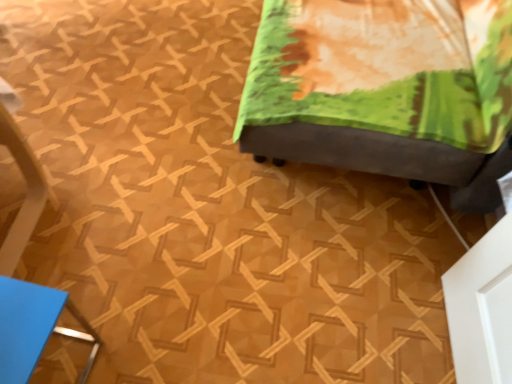
At what (x,y) coordinates should I click in order to perform the action: click on velvet green ottoman at center, which appears as the first furniture when viewed from the right. Please return your answer as a coordinate pair (x, y). This screenshot has height=384, width=512. Looking at the image, I should click on (391, 115).

What do you see at coordinates (391, 115) in the screenshot? The height and width of the screenshot is (384, 512). I see `velvet green ottoman at center, which appears as the first furniture when viewed from the right` at bounding box center [391, 115].

Where is `blue matte folder at lower left, marked as the first furniture in a bottom-to-top arrangement`? Image resolution: width=512 pixels, height=384 pixels. blue matte folder at lower left, marked as the first furniture in a bottom-to-top arrangement is located at coordinates (33, 327).

What is the approximate height of blue matte folder at lower left, marked as the first furniture in a bottom-to-top arrangement?

It is 14.44 inches.

Measure the distance between point (12, 351) and camera.

32.32 inches.

Describe the element at coordinates (33, 327) in the screenshot. The image size is (512, 384). I see `blue matte folder at lower left, the 1th furniture when ordered from left to right` at that location.

Identify the location of velvet green ottoman at center, which appears as the first furniture when viewed from the right. (391, 115).

Is blue matte folder at lower left, the 1th furniture when ordered from left to right, at the right side of velvet green ottoman at center, placed as the 2th furniture when sorted from bottom to top?

No, blue matte folder at lower left, the 1th furniture when ordered from left to right, is not to the right of velvet green ottoman at center, placed as the 2th furniture when sorted from bottom to top.

From the picture: Between blue matte folder at lower left, the 1th furniture when ordered from left to right, and velvet green ottoman at center, which appears as the first furniture when viewed from the right, which one is positioned in front?

blue matte folder at lower left, the 1th furniture when ordered from left to right, is closer to the camera.

Considering the points (6, 382) and (245, 123), which point is in front, point (6, 382) or point (245, 123)?

The point (6, 382) is more forward.

From the image's perspective, between blue matte folder at lower left, marked as the first furniture in a bottom-to-top arrangement, and velvet green ottoman at center, placed as the 2th furniture when sorted from bottom to top, who is located below?

blue matte folder at lower left, marked as the first furniture in a bottom-to-top arrangement, is shown below in the image.

From a real-world perspective, which object stands above the other?

From a 3D spatial view, velvet green ottoman at center, which appears as the second furniture when viewed from the left, is above.

Can you confirm if blue matte folder at lower left, positioned as the 2th furniture in right-to-left order, is thinner than velvet green ottoman at center, the first furniture in the top-to-bottom sequence?

Indeed, blue matte folder at lower left, positioned as the 2th furniture in right-to-left order, has a lesser width compared to velvet green ottoman at center, the first furniture in the top-to-bottom sequence.

Is blue matte folder at lower left, the 1th furniture when ordered from left to right, taller or shorter than velvet green ottoman at center, which appears as the first furniture when viewed from the right?

blue matte folder at lower left, the 1th furniture when ordered from left to right, is shorter than velvet green ottoman at center, which appears as the first furniture when viewed from the right.

From the picture: Can you confirm if blue matte folder at lower left, the 1th furniture when ordered from left to right, is bigger than velvet green ottoman at center, which appears as the second furniture when viewed from the left?

No, blue matte folder at lower left, the 1th furniture when ordered from left to right, is not bigger than velvet green ottoman at center, which appears as the second furniture when viewed from the left.

Choose the correct answer: Is blue matte folder at lower left, marked as the first furniture in a bottom-to-top arrangement, inside velvet green ottoman at center, which appears as the second furniture when viewed from the left, or outside it?

blue matte folder at lower left, marked as the first furniture in a bottom-to-top arrangement, is not inside velvet green ottoman at center, which appears as the second furniture when viewed from the left, it's outside.

Is blue matte folder at lower left, the 1th furniture when ordered from left to right, not close to velvet green ottoman at center, which appears as the first furniture when viewed from the right?

They are positioned close to each other.

Is blue matte folder at lower left, the 2th furniture in the top-to-bottom sequence, turned away from velvet green ottoman at center, which appears as the second furniture when viewed from the left?

blue matte folder at lower left, the 2th furniture in the top-to-bottom sequence, does not have its back to velvet green ottoman at center, which appears as the second furniture when viewed from the left.

What's the angular difference between blue matte folder at lower left, marked as the first furniture in a bottom-to-top arrangement, and velvet green ottoman at center, the first furniture in the top-to-bottom sequence,'s facing directions?

They differ by 92.8 degrees in their facing directions.

Measure the distance from blue matte folder at lower left, positioned as the 2th furniture in right-to-left order, to velvet green ottoman at center, which appears as the first furniture when viewed from the right.

37.43 inches.

At what (x,y) coordinates should I click in order to perform the action: click on furniture lying below the velvet green ottoman at center, the first furniture in the top-to-bottom sequence (from the image's perspective). Please return your answer as a coordinate pair (x, y). The height and width of the screenshot is (384, 512). Looking at the image, I should click on coord(33,327).

Is velvet green ottoman at center, the first furniture in the top-to-bottom sequence, at the left side of blue matte folder at lower left, the 1th furniture when ordered from left to right?

No.

Which is behind, velvet green ottoman at center, placed as the 2th furniture when sorted from bottom to top, or blue matte folder at lower left, the 1th furniture when ordered from left to right?

Positioned behind is velvet green ottoman at center, placed as the 2th furniture when sorted from bottom to top.

Which is nearer, (279,46) or (24,350)?

Clearly, point (279,46) is more distant from the camera than point (24,350).

From the image's perspective, is velvet green ottoman at center, the first furniture in the top-to-bottom sequence, positioned above or below blue matte folder at lower left, positioned as the 2th furniture in right-to-left order?

From the image's perspective, velvet green ottoman at center, the first furniture in the top-to-bottom sequence, appears above blue matte folder at lower left, positioned as the 2th furniture in right-to-left order.

From a real-world perspective, relative to blue matte folder at lower left, positioned as the 2th furniture in right-to-left order, is velvet green ottoman at center, which appears as the second furniture when viewed from the left, vertically above or below?

From a real-world perspective, velvet green ottoman at center, which appears as the second furniture when viewed from the left, is physically above blue matte folder at lower left, positioned as the 2th furniture in right-to-left order.

Considering the sizes of velvet green ottoman at center, which appears as the first furniture when viewed from the right, and blue matte folder at lower left, the 2th furniture in the top-to-bottom sequence, in the image, is velvet green ottoman at center, which appears as the first furniture when viewed from the right, wider or thinner than blue matte folder at lower left, the 2th furniture in the top-to-bottom sequence,?

velvet green ottoman at center, which appears as the first furniture when viewed from the right, is wider than blue matte folder at lower left, the 2th furniture in the top-to-bottom sequence.

Who is shorter, velvet green ottoman at center, which appears as the second furniture when viewed from the left, or blue matte folder at lower left, the 2th furniture in the top-to-bottom sequence?

Standing shorter between the two is blue matte folder at lower left, the 2th furniture in the top-to-bottom sequence.

Who is bigger, velvet green ottoman at center, the first furniture in the top-to-bottom sequence, or blue matte folder at lower left, the 1th furniture when ordered from left to right?

With larger size is velvet green ottoman at center, the first furniture in the top-to-bottom sequence.

Would you say blue matte folder at lower left, marked as the first furniture in a bottom-to-top arrangement, is part of velvet green ottoman at center, placed as the 2th furniture when sorted from bottom to top,'s contents?

That's incorrect, blue matte folder at lower left, marked as the first furniture in a bottom-to-top arrangement, is not inside velvet green ottoman at center, placed as the 2th furniture when sorted from bottom to top.

Is there a large distance between velvet green ottoman at center, the first furniture in the top-to-bottom sequence, and blue matte folder at lower left, marked as the first furniture in a bottom-to-top arrangement?

Actually, velvet green ottoman at center, the first furniture in the top-to-bottom sequence, and blue matte folder at lower left, marked as the first furniture in a bottom-to-top arrangement, are a little close together.

Based on the photo, is velvet green ottoman at center, the first furniture in the top-to-bottom sequence, positioned with its back to blue matte folder at lower left, the 2th furniture in the top-to-bottom sequence?

That's not correct — velvet green ottoman at center, the first furniture in the top-to-bottom sequence, is not looking away from blue matte folder at lower left, the 2th furniture in the top-to-bottom sequence.

What's the angular difference between velvet green ottoman at center, which appears as the first furniture when viewed from the right, and blue matte folder at lower left, positioned as the 2th furniture in right-to-left order,'s facing directions?

The angular difference between velvet green ottoman at center, which appears as the first furniture when viewed from the right, and blue matte folder at lower left, positioned as the 2th furniture in right-to-left order, is 92.8 degrees.

Could you measure the distance between velvet green ottoman at center, the first furniture in the top-to-bottom sequence, and blue matte folder at lower left, the 2th furniture in the top-to-bottom sequence?

velvet green ottoman at center, the first furniture in the top-to-bottom sequence, is 37.43 inches from blue matte folder at lower left, the 2th furniture in the top-to-bottom sequence.

The image size is (512, 384). I want to click on furniture behind the blue matte folder at lower left, marked as the first furniture in a bottom-to-top arrangement, so click(x=391, y=115).

Where is `furniture lying above the blue matte folder at lower left, positioned as the 2th furniture in right-to-left order (from the image's perspective)`? furniture lying above the blue matte folder at lower left, positioned as the 2th furniture in right-to-left order (from the image's perspective) is located at coordinates (391, 115).

Locate an element on the screen. The image size is (512, 384). furniture on the right of blue matte folder at lower left, the 1th furniture when ordered from left to right is located at coordinates (391, 115).